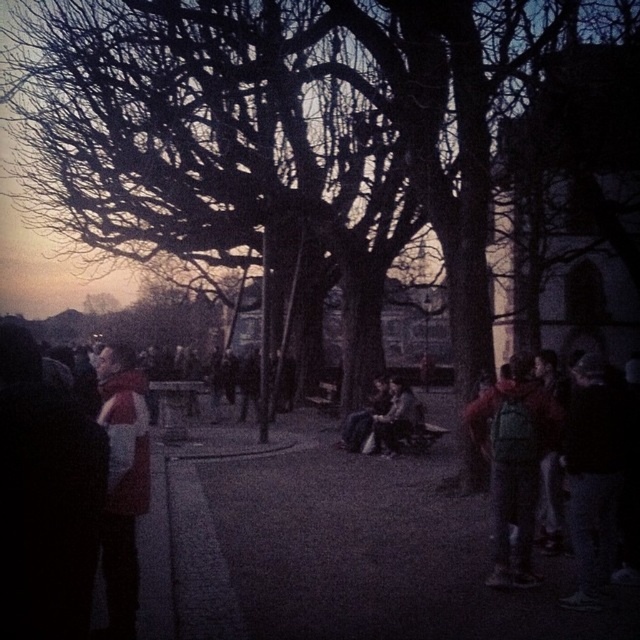
In the scene shown: Does red backpack at right appear on the right side of dark brown leather jacket at center?

Indeed, red backpack at right is positioned on the right side of dark brown leather jacket at center.

From the picture: Between red backpack at right and dark brown leather jacket at center, which one has more height?

With more height is red backpack at right.

Describe the element at coordinates (513, 464) in the screenshot. This screenshot has height=640, width=640. I see `red backpack at right` at that location.

Where is `red backpack at right`? This screenshot has width=640, height=640. red backpack at right is located at coordinates click(x=513, y=464).

Can you confirm if matte red scarf at left is thinner than dark gray fabric jacket at center?

Correct, matte red scarf at left's width is less than dark gray fabric jacket at center's.

Locate an element on the screen. The height and width of the screenshot is (640, 640). matte red scarf at left is located at coordinates (122, 483).

Measure the distance between matte red scarf at left and camera.

matte red scarf at left is 11.35 feet away from camera.

Find the location of a particular element. The width and height of the screenshot is (640, 640). matte red scarf at left is located at coordinates (122, 483).

Is dark brown leather jacket at center thinner than dark gray fabric jacket at center?

Yes, dark brown leather jacket at center is thinner than dark gray fabric jacket at center.

Does point (417, 420) lie in front of point (372, 384)?

Yes.

Where is `dark brown leather jacket at center`? dark brown leather jacket at center is located at coordinates (396, 419).